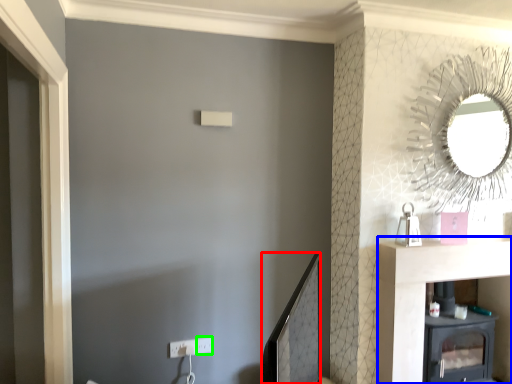
Question: Considering the real-world distances, which object is closest to mirror (highlighted by a red box)? vanity (highlighted by a blue box) or electric outlet (highlighted by a green box).

Choices:
 (A) vanity
 (B) electric outlet

Answer: (B)